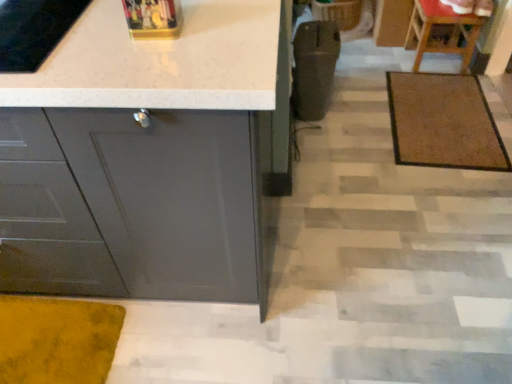
Locate an element on the screen. The image size is (512, 384). empty space that is in between wooden chair at upper right and brown textured mat at center right is located at coordinates (409, 66).